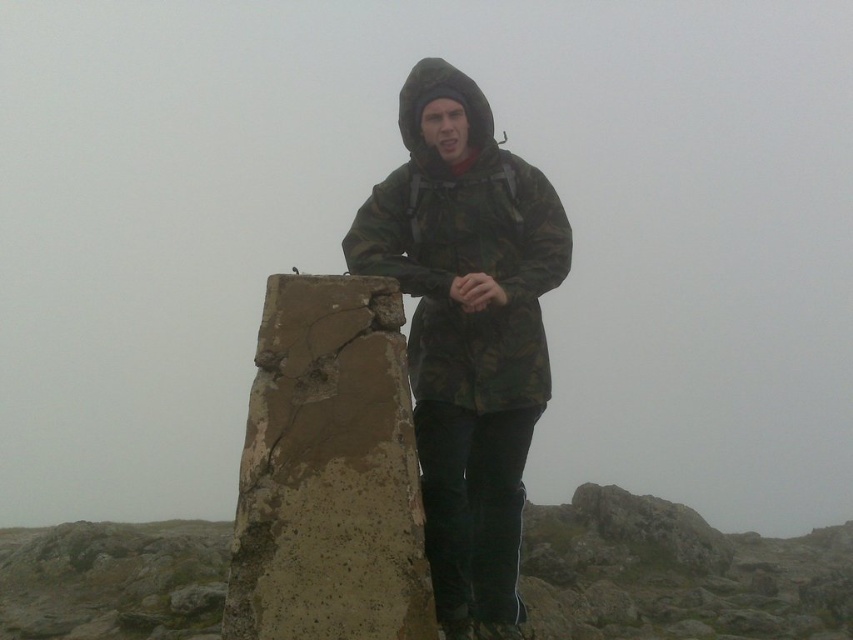
You are a hiker who just arrived at the mountain. You see a brown concrete block at center and a camo fabric jacket at center. Which object is wider?

The camo fabric jacket at center is wider than the brown concrete block at center.

You are standing at the trig point and want to take a photo of the person who is at point (x=408, y=593). Your camera has a maximum focus range of 5 meters. Will the camera be able to focus on the person?

The distance between point (x=408, y=593) and the viewer is 4.68 meters, which is within the camera maximum focus range of 5 meters. Therefore, the camera can focus on the person.

You are a hiker who wants to place a small GPS device on the highest point between the brown concrete block at center and the camo fabric jacket at center. Which object should you choose?

The camo fabric jacket at center is higher than the brown concrete block at center, so you should place the GPS device on the camo fabric jacket at center.